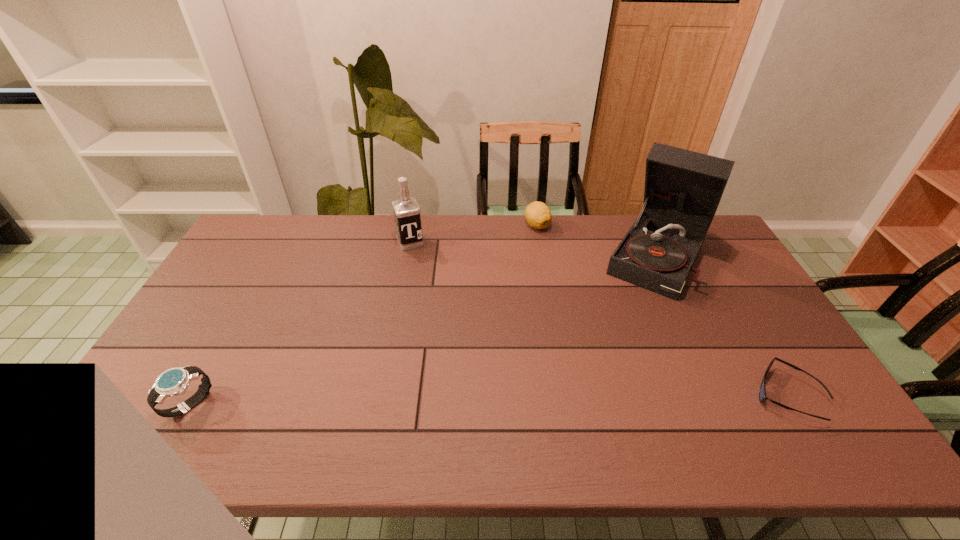
Where is `vacant space situated 0.250m on the front-facing side of the tallest object`? vacant space situated 0.250m on the front-facing side of the tallest object is located at coordinates (612, 346).

I want to click on lemon positioned at the far edge, so click(538, 215).

The height and width of the screenshot is (540, 960). In order to click on vodka situated at the far edge in this screenshot , I will do (x=406, y=210).

Locate an element on the screen. This screenshot has width=960, height=540. phonograph_record present at the far edge is located at coordinates pyautogui.click(x=683, y=188).

At what (x,y) coordinates should I click in order to perform the action: click on watch that is at the near edge. Please return your answer as a coordinate pair (x, y). This screenshot has height=540, width=960. Looking at the image, I should click on (173, 382).

The width and height of the screenshot is (960, 540). I want to click on sunglasses that is at the near edge, so click(762, 393).

Where is `object located in the left edge section of the desktop`? The width and height of the screenshot is (960, 540). object located in the left edge section of the desktop is located at coordinates (173, 382).

Where is `sunglasses at the right edge`? This screenshot has width=960, height=540. sunglasses at the right edge is located at coordinates (762, 393).

The height and width of the screenshot is (540, 960). What are the coordinates of `phonograph_record present at the right edge` in the screenshot? It's located at pyautogui.click(x=683, y=188).

You are a GUI agent. You are given a task and a screenshot of the screen. Output one action in this format:
    pyautogui.click(x=<x>, y=<y>)
    Task: Click on the object present at the near left corner
    This screenshot has height=540, width=960.
    Given the screenshot: What is the action you would take?
    pyautogui.click(x=173, y=382)